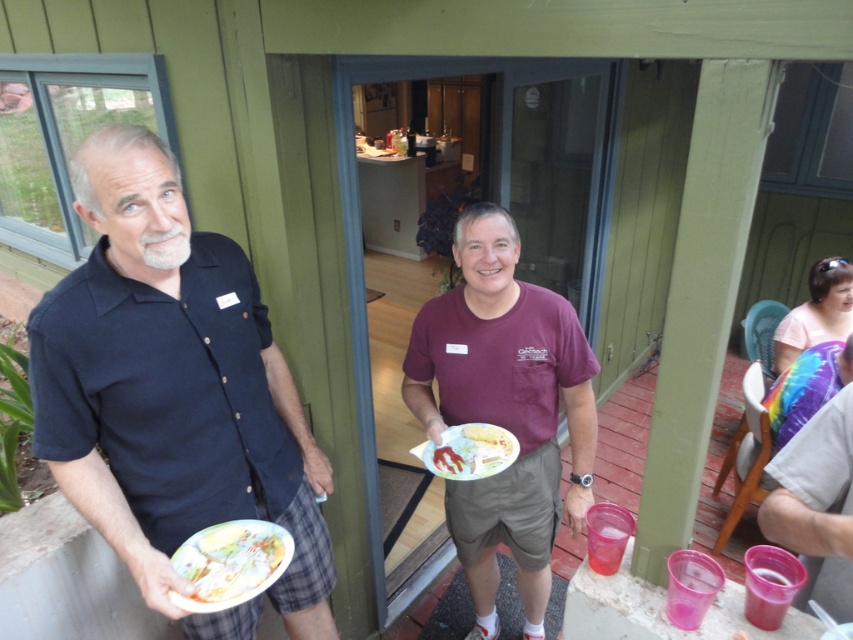
You are a photographer at the event and need to capture a photo that includes both the matte black shirt at left and the rainbow fabric shirt at right. Based on their positions, which shirt should you focus on first to ensure both are in frame?

The matte black shirt at left is below the rainbow fabric shirt at right, so you should focus on the rainbow fabric shirt at right first to ensure both are in frame.

You are a photographer standing at the edge of the gathering. You want to take a photo that includes both the maroon fabric shirt at center and the printed paper plate at lower left. Given their distance apart, will they both fit in your camera frame if your camera has a 50 cm field of view?

The maroon fabric shirt at center is 70.92 centimeters away from the printed paper plate at lower left. Since the distance between them exceeds the camera frame of 50 cm, they might not both fit in the frame.

You are standing at the porch and want to walk from point A to point B. Point A is at coordinate point (584,368) and point B is at coordinate point (207,604). Since you can only move forward, which point will you reach first?

You will reach point B at coordinate point (207,604) first because point A at coordinate point (584,368) is further away from you than point B.